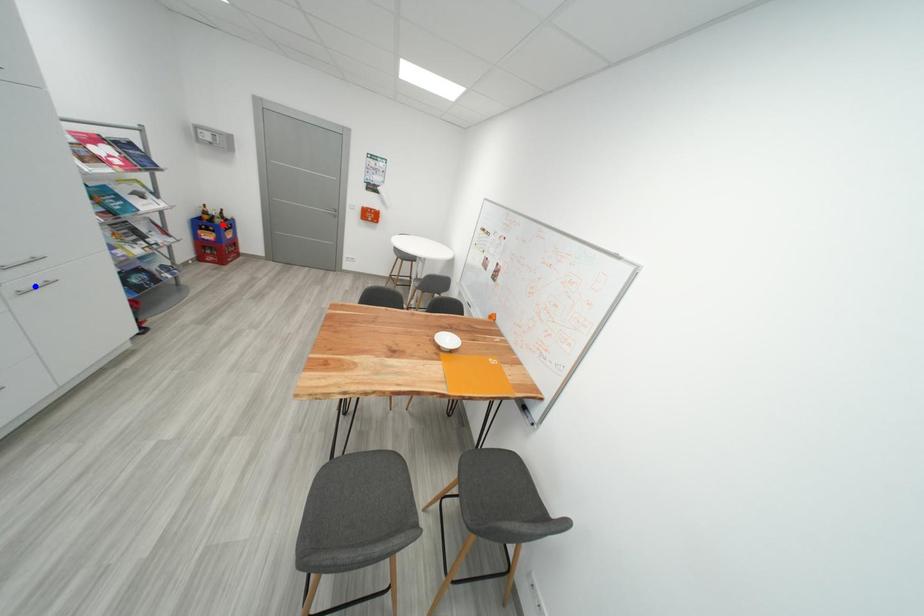
Question: Which of the two points in the image is closer to the camera?

Choices:
 (A) Blue point is closer.
 (B) Red point is closer.

Answer: (A)